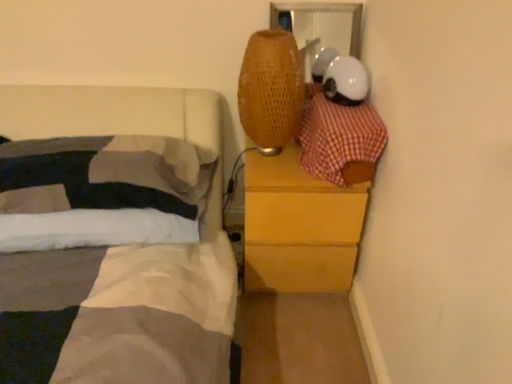
Question: Is red checkered fabric at upper right located outside wooden chest of drawers at right?

Choices:
 (A) no
 (B) yes

Answer: (B)

Question: Does red checkered fabric at upper right have a greater width compared to wooden chest of drawers at right?

Choices:
 (A) yes
 (B) no

Answer: (B)

Question: Is red checkered fabric at upper right looking in the opposite direction of wooden chest of drawers at right?

Choices:
 (A) yes
 (B) no

Answer: (B)

Question: From a real-world perspective, is red checkered fabric at upper right physically above wooden chest of drawers at right?

Choices:
 (A) no
 (B) yes

Answer: (B)

Question: Does red checkered fabric at upper right contain wooden chest of drawers at right?

Choices:
 (A) no
 (B) yes

Answer: (A)

Question: Is wooden chest of drawers at right bigger or smaller than red checkered fabric at upper right?

Choices:
 (A) small
 (B) big

Answer: (B)

Question: Is point (295, 188) positioned closer to the camera than point (316, 167)?

Choices:
 (A) farther
 (B) closer

Answer: (A)

Question: From a real-world perspective, is wooden chest of drawers at right above or below red checkered fabric at upper right?

Choices:
 (A) above
 (B) below

Answer: (B)

Question: Is wooden chest of drawers at right inside the boundaries of red checkered fabric at upper right, or outside?

Choices:
 (A) inside
 (B) outside

Answer: (B)

Question: In the image, is wooden chest of drawers at right positioned in front of or behind white soft pillow at left?

Choices:
 (A) front
 (B) behind

Answer: (B)

Question: Considering the positions of point (304, 248) and point (91, 200), is point (304, 248) closer or farther from the camera than point (91, 200)?

Choices:
 (A) closer
 (B) farther

Answer: (B)

Question: Considering the positions of wooden chest of drawers at right and white soft pillow at left in the image, is wooden chest of drawers at right taller or shorter than white soft pillow at left?

Choices:
 (A) short
 (B) tall

Answer: (B)

Question: From the image's perspective, is wooden chest of drawers at right above or below white soft pillow at left?

Choices:
 (A) above
 (B) below

Answer: (B)

Question: Is red checkered fabric at upper right wider or thinner than wooden chest of drawers at right?

Choices:
 (A) wide
 (B) thin

Answer: (B)

Question: Is red checkered fabric at upper right spatially inside wooden chest of drawers at right, or outside of it?

Choices:
 (A) inside
 (B) outside

Answer: (B)